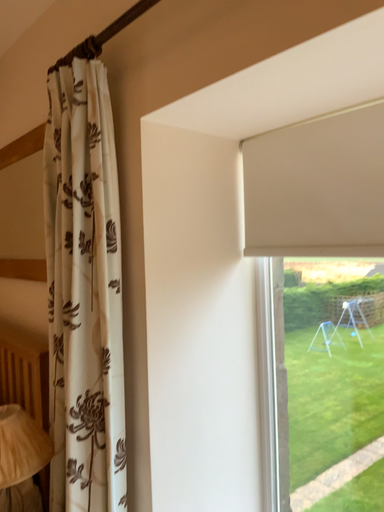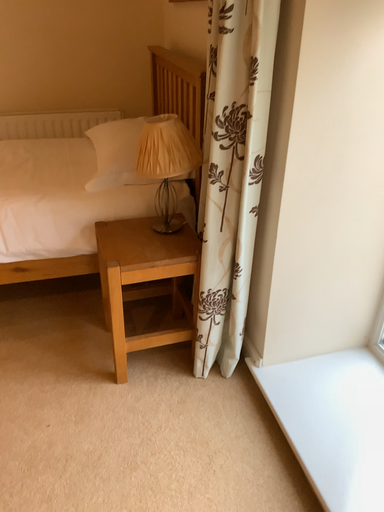
Question: How did the camera likely rotate when shooting the video?

Choices:
 (A) rotated left
 (B) rotated right

Answer: (A)